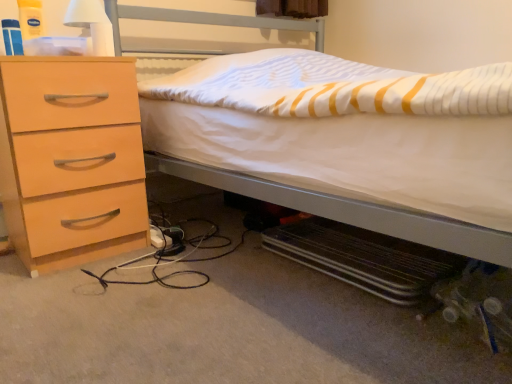
Question: From the image's perspective, is white matte bed at center located above white matte lampshade at upper left?

Choices:
 (A) yes
 (B) no

Answer: (B)

Question: Is white matte bed at center aimed at white matte lampshade at upper left?

Choices:
 (A) no
 (B) yes

Answer: (A)

Question: Does white matte bed at center appear on the right side of white matte lampshade at upper left?

Choices:
 (A) yes
 (B) no

Answer: (A)

Question: Is white matte bed at center further to the viewer compared to white matte lampshade at upper left?

Choices:
 (A) yes
 (B) no

Answer: (B)

Question: Is white matte bed at center facing away from white matte lampshade at upper left?

Choices:
 (A) no
 (B) yes

Answer: (A)

Question: From the image's perspective, is white matte lampshade at upper left positioned above or below light wood/finish chest of drawers at left?

Choices:
 (A) below
 (B) above

Answer: (B)

Question: From a real-world perspective, is white matte lampshade at upper left positioned above or below light wood/finish chest of drawers at left?

Choices:
 (A) above
 (B) below

Answer: (A)

Question: Is point (101, 21) closer or farther from the camera than point (96, 66)?

Choices:
 (A) farther
 (B) closer

Answer: (A)

Question: Is white matte lampshade at upper left bigger or smaller than light wood/finish chest of drawers at left?

Choices:
 (A) small
 (B) big

Answer: (A)

Question: From a real-world perspective, is white matte lampshade at upper left above or below white matte bed at center?

Choices:
 (A) below
 (B) above

Answer: (B)

Question: Considering the relative positions of white matte lampshade at upper left and white matte bed at center in the image provided, is white matte lampshade at upper left to the left or to the right of white matte bed at center?

Choices:
 (A) left
 (B) right

Answer: (A)

Question: Relative to white matte bed at center, is white matte lampshade at upper left in front or behind?

Choices:
 (A) behind
 (B) front

Answer: (A)

Question: From the image's perspective, is white matte lampshade at upper left above or below white matte bed at center?

Choices:
 (A) below
 (B) above

Answer: (B)

Question: In terms of size, does white matte bed at center appear bigger or smaller than light wood/finish chest of drawers at left?

Choices:
 (A) big
 (B) small

Answer: (A)

Question: Is white matte bed at center wider or thinner than light wood/finish chest of drawers at left?

Choices:
 (A) wide
 (B) thin

Answer: (A)